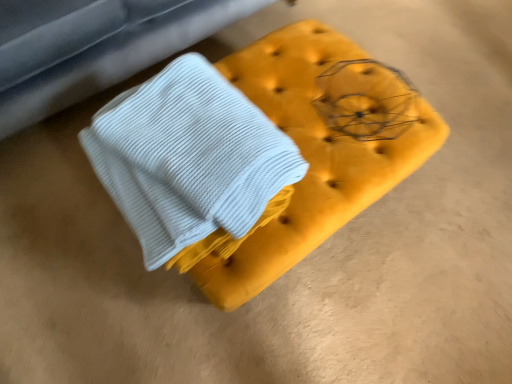
What do you see at coordinates (101, 51) in the screenshot? I see `white ribbed fabric at center, which is the second furniture in bottom-to-top order` at bounding box center [101, 51].

How much space does white ribbed fabric at center, which is the second furniture in bottom-to-top order, occupy vertically?

white ribbed fabric at center, which is the second furniture in bottom-to-top order, is 21.92 inches in height.

At what (x,y) coordinates should I click in order to perform the action: click on white ribbed fabric at center, positioned as the 1th furniture in top-to-bottom order. Please return your answer as a coordinate pair (x, y). This screenshot has width=512, height=384. Looking at the image, I should click on click(101, 51).

Measure the distance between point (x=211, y=257) and camera.

Point (x=211, y=257) and camera are 97.10 centimeters apart from each other.

At what (x,y) coordinates should I click in order to perform the action: click on velvet yellow ottoman at center, which is the 1th furniture in bottom-to-top order. Please return your answer as a coordinate pair (x, y). The height and width of the screenshot is (384, 512). Looking at the image, I should click on (317, 149).

Describe the element at coordinates (317, 149) in the screenshot. I see `velvet yellow ottoman at center, the 2th furniture from the top` at that location.

Where is `white ribbed fabric at center, positioned as the 1th furniture in top-to-bottom order`? The height and width of the screenshot is (384, 512). white ribbed fabric at center, positioned as the 1th furniture in top-to-bottom order is located at coordinates pos(101,51).

Visually, is white ribbed fabric at center, which is the second furniture in bottom-to-top order, positioned to the left or to the right of velvet yellow ottoman at center, which is the 1th furniture in bottom-to-top order?

Based on their positions, white ribbed fabric at center, which is the second furniture in bottom-to-top order, is located to the left of velvet yellow ottoman at center, which is the 1th furniture in bottom-to-top order.

Considering their positions, is white ribbed fabric at center, positioned as the 1th furniture in top-to-bottom order, located in front of or behind velvet yellow ottoman at center, which is the 1th furniture in bottom-to-top order?

In the image, white ribbed fabric at center, positioned as the 1th furniture in top-to-bottom order, appears behind velvet yellow ottoman at center, which is the 1th furniture in bottom-to-top order.

Which point is more distant from viewer, (140, 11) or (207, 278)?

The point (140, 11) is farther.

From the image's perspective, is white ribbed fabric at center, which is the second furniture in bottom-to-top order, located above velvet yellow ottoman at center, which is the 1th furniture in bottom-to-top order?

Yes, from the image's perspective, white ribbed fabric at center, which is the second furniture in bottom-to-top order, is over velvet yellow ottoman at center, which is the 1th furniture in bottom-to-top order.

From a real-world perspective, which is physically below, white ribbed fabric at center, which is the second furniture in bottom-to-top order, or velvet yellow ottoman at center, the 2th furniture from the top?

velvet yellow ottoman at center, the 2th furniture from the top, from a real-world perspective.

Which of these two, white ribbed fabric at center, which is the second furniture in bottom-to-top order, or velvet yellow ottoman at center, the 2th furniture from the top, is thinner?

With smaller width is velvet yellow ottoman at center, the 2th furniture from the top.

Considering the sizes of objects white ribbed fabric at center, positioned as the 1th furniture in top-to-bottom order, and velvet yellow ottoman at center, which is the 1th furniture in bottom-to-top order, in the image provided, who is taller, white ribbed fabric at center, positioned as the 1th furniture in top-to-bottom order, or velvet yellow ottoman at center, which is the 1th furniture in bottom-to-top order,?

With more height is white ribbed fabric at center, positioned as the 1th furniture in top-to-bottom order.

Considering the relative sizes of white ribbed fabric at center, which is the second furniture in bottom-to-top order, and velvet yellow ottoman at center, the 2th furniture from the top, in the image provided, is white ribbed fabric at center, which is the second furniture in bottom-to-top order, bigger than velvet yellow ottoman at center, the 2th furniture from the top,?

Correct, white ribbed fabric at center, which is the second furniture in bottom-to-top order, is larger in size than velvet yellow ottoman at center, the 2th furniture from the top.

Is white ribbed fabric at center, which is the second furniture in bottom-to-top order, not within velvet yellow ottoman at center, which is the 1th furniture in bottom-to-top order?

Yes, white ribbed fabric at center, which is the second furniture in bottom-to-top order, is outside of velvet yellow ottoman at center, which is the 1th furniture in bottom-to-top order.

Is white ribbed fabric at center, positioned as the 1th furniture in top-to-bottom order, far away from velvet yellow ottoman at center, which is the 1th furniture in bottom-to-top order?

No, white ribbed fabric at center, positioned as the 1th furniture in top-to-bottom order, is in close proximity to velvet yellow ottoman at center, which is the 1th furniture in bottom-to-top order.

Based on the photo, is white ribbed fabric at center, which is the second furniture in bottom-to-top order, facing towards velvet yellow ottoman at center, the 2th furniture from the top?

Yes, white ribbed fabric at center, which is the second furniture in bottom-to-top order, faces towards velvet yellow ottoman at center, the 2th furniture from the top.

Where is `furniture above the velvet yellow ottoman at center, the 2th furniture from the top (from a real-world perspective)`? The image size is (512, 384). furniture above the velvet yellow ottoman at center, the 2th furniture from the top (from a real-world perspective) is located at coordinates (101, 51).

Between velvet yellow ottoman at center, the 2th furniture from the top, and white ribbed fabric at center, which is the second furniture in bottom-to-top order, which one appears on the right side from the viewer's perspective?

From the viewer's perspective, velvet yellow ottoman at center, the 2th furniture from the top, appears more on the right side.

Based on the photo, which object is further away from the camera taking this photo, velvet yellow ottoman at center, the 2th furniture from the top, or white ribbed fabric at center, positioned as the 1th furniture in top-to-bottom order?

white ribbed fabric at center, positioned as the 1th furniture in top-to-bottom order, is behind.

Considering the points (254, 80) and (163, 12), which point is in front, point (254, 80) or point (163, 12)?

Point (254, 80)

From the image's perspective, is velvet yellow ottoman at center, which is the 1th furniture in bottom-to-top order, on white ribbed fabric at center, positioned as the 1th furniture in top-to-bottom order?

Actually, velvet yellow ottoman at center, which is the 1th furniture in bottom-to-top order, appears below white ribbed fabric at center, positioned as the 1th furniture in top-to-bottom order, in the image.

From a real-world perspective, is velvet yellow ottoman at center, which is the 1th furniture in bottom-to-top order, on top of white ribbed fabric at center, positioned as the 1th furniture in top-to-bottom order?

Incorrect, from a real-world perspective, velvet yellow ottoman at center, which is the 1th furniture in bottom-to-top order, is lower than white ribbed fabric at center, positioned as the 1th furniture in top-to-bottom order.

Is velvet yellow ottoman at center, the 2th furniture from the top, wider or thinner than white ribbed fabric at center, which is the second furniture in bottom-to-top order?

velvet yellow ottoman at center, the 2th furniture from the top, is thinner than white ribbed fabric at center, which is the second furniture in bottom-to-top order.

Can you confirm if velvet yellow ottoman at center, the 2th furniture from the top, is taller than white ribbed fabric at center, positioned as the 1th furniture in top-to-bottom order?

Incorrect, the height of velvet yellow ottoman at center, the 2th furniture from the top, is not larger of that of white ribbed fabric at center, positioned as the 1th furniture in top-to-bottom order.

In the scene shown: Between velvet yellow ottoman at center, which is the 1th furniture in bottom-to-top order, and white ribbed fabric at center, positioned as the 1th furniture in top-to-bottom order, which one has smaller size?

Smaller between the two is velvet yellow ottoman at center, which is the 1th furniture in bottom-to-top order.

Is white ribbed fabric at center, positioned as the 1th furniture in top-to-bottom order, completely or partially inside velvet yellow ottoman at center, the 2th furniture from the top?

That's incorrect, white ribbed fabric at center, positioned as the 1th furniture in top-to-bottom order, is not inside velvet yellow ottoman at center, the 2th furniture from the top.

Is velvet yellow ottoman at center, which is the 1th furniture in bottom-to-top order, touching white ribbed fabric at center, which is the second furniture in bottom-to-top order?

No.

Is velvet yellow ottoman at center, which is the 1th furniture in bottom-to-top order, oriented towards white ribbed fabric at center, positioned as the 1th furniture in top-to-bottom order?

No, velvet yellow ottoman at center, which is the 1th furniture in bottom-to-top order, is not oriented towards white ribbed fabric at center, positioned as the 1th furniture in top-to-bottom order.

The width and height of the screenshot is (512, 384). What are the coordinates of `furniture above the velvet yellow ottoman at center, which is the 1th furniture in bottom-to-top order (from the image's perspective)` in the screenshot? It's located at (101, 51).

In the image, there is a white ribbed fabric at center, which is the second furniture in bottom-to-top order. Where is `furniture below it (from a real-world perspective)`? furniture below it (from a real-world perspective) is located at coordinates (317, 149).

Where is `furniture that is below the white ribbed fabric at center, positioned as the 1th furniture in top-to-bottom order (from the image's perspective)`? The width and height of the screenshot is (512, 384). furniture that is below the white ribbed fabric at center, positioned as the 1th furniture in top-to-bottom order (from the image's perspective) is located at coordinates (317, 149).